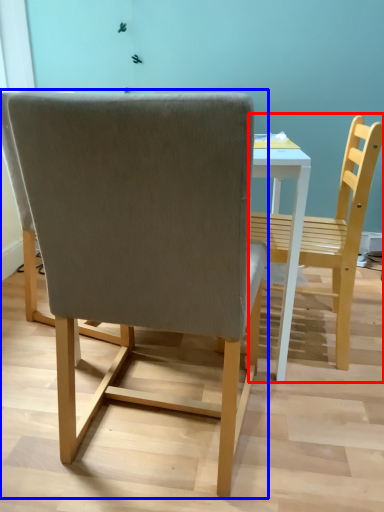
Question: Which object appears farthest to the camera in this image, chair (highlighted by a red box) or chair (highlighted by a blue box)?

Choices:
 (A) chair
 (B) chair

Answer: (A)